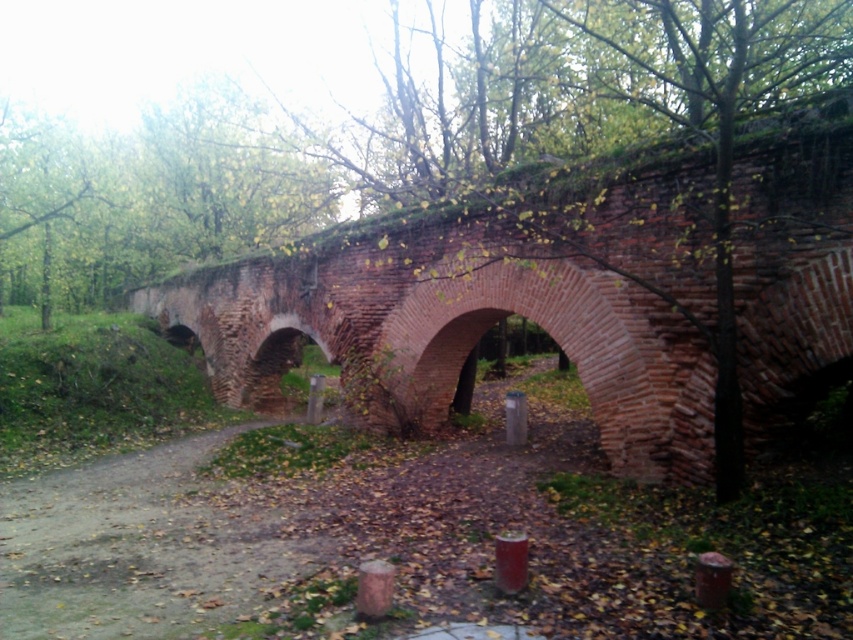
Is point (637, 410) positioned behind point (64, 612)?

Yes, point (637, 410) is farther from viewer.

Is red brick bridge at center in front of dirt path at center?

Yes, red brick bridge at center is in front of dirt path at center.

You are a GUI agent. You are given a task and a screenshot of the screen. Output one action in this format:
    pyautogui.click(x=<x>, y=<y>)
    Task: Click on the red brick bridge at center
    This screenshot has width=853, height=640.
    Given the screenshot: What is the action you would take?
    click(x=488, y=308)